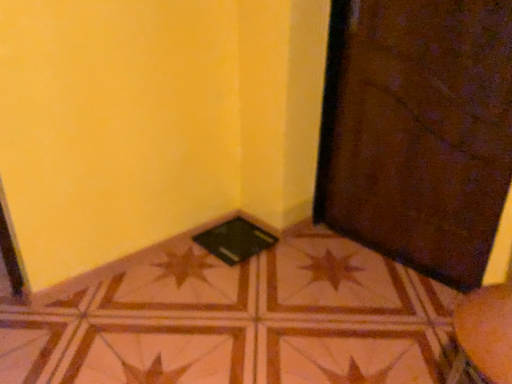
Question: Can you confirm if black matte pad at lower center is shorter than brown textured door at lower right?

Choices:
 (A) yes
 (B) no

Answer: (A)

Question: From a real-world perspective, is black matte pad at lower center physically above brown textured door at lower right?

Choices:
 (A) yes
 (B) no

Answer: (B)

Question: Would you say black matte pad at lower center is outside brown textured door at lower right?

Choices:
 (A) yes
 (B) no

Answer: (A)

Question: Does black matte pad at lower center have a larger size compared to brown textured door at lower right?

Choices:
 (A) no
 (B) yes

Answer: (A)

Question: Is the surface of black matte pad at lower center in direct contact with brown textured door at lower right?

Choices:
 (A) yes
 (B) no

Answer: (B)

Question: From a real-world perspective, is black matte pad at lower center beneath brown textured door at lower right?

Choices:
 (A) no
 (B) yes

Answer: (B)

Question: From a real-world perspective, does brown textured door at lower right stand above black matte pad at lower center?

Choices:
 (A) yes
 (B) no

Answer: (A)

Question: Could you tell me if brown textured door at lower right is facing black matte pad at lower center?

Choices:
 (A) no
 (B) yes

Answer: (A)

Question: Can you confirm if brown textured door at lower right is thinner than black matte pad at lower center?

Choices:
 (A) yes
 (B) no

Answer: (A)

Question: From a real-world perspective, is brown textured door at lower right physically below black matte pad at lower center?

Choices:
 (A) no
 (B) yes

Answer: (A)

Question: Considering the relative positions of brown textured door at lower right and black matte pad at lower center in the image provided, is brown textured door at lower right to the left of black matte pad at lower center from the viewer's perspective?

Choices:
 (A) no
 (B) yes

Answer: (A)

Question: Is brown textured door at lower right completely or partially outside of black matte pad at lower center?

Choices:
 (A) yes
 (B) no

Answer: (A)

Question: From a real-world perspective, is brown glossy tile at center physically below black matte pad at lower center?

Choices:
 (A) yes
 (B) no

Answer: (A)